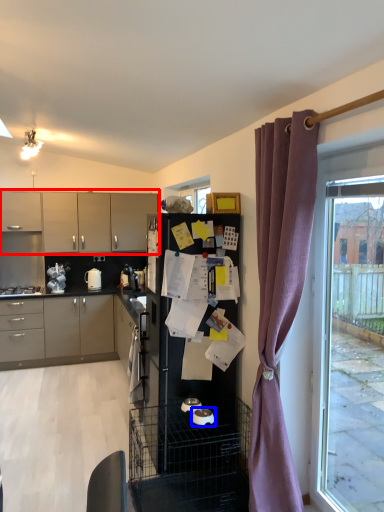
Question: Among these objects, which one is farthest to the camera, cabinetry (highlighted by a red box) or appliance (highlighted by a blue box)?

Choices:
 (A) cabinetry
 (B) appliance

Answer: (A)